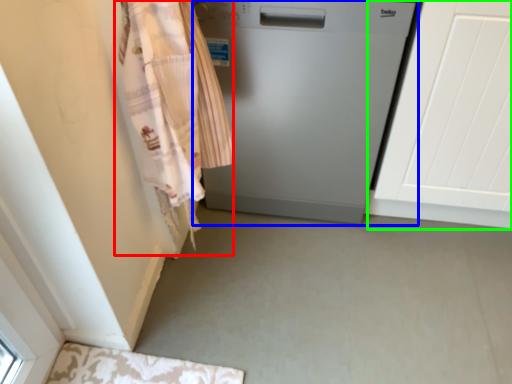
Question: Based on their relative distances, which object is nearer to clothing (highlighted by a red box)? Choose from home appliance (highlighted by a blue box) and screen door (highlighted by a green box).

Choices:
 (A) home appliance
 (B) screen door

Answer: (A)